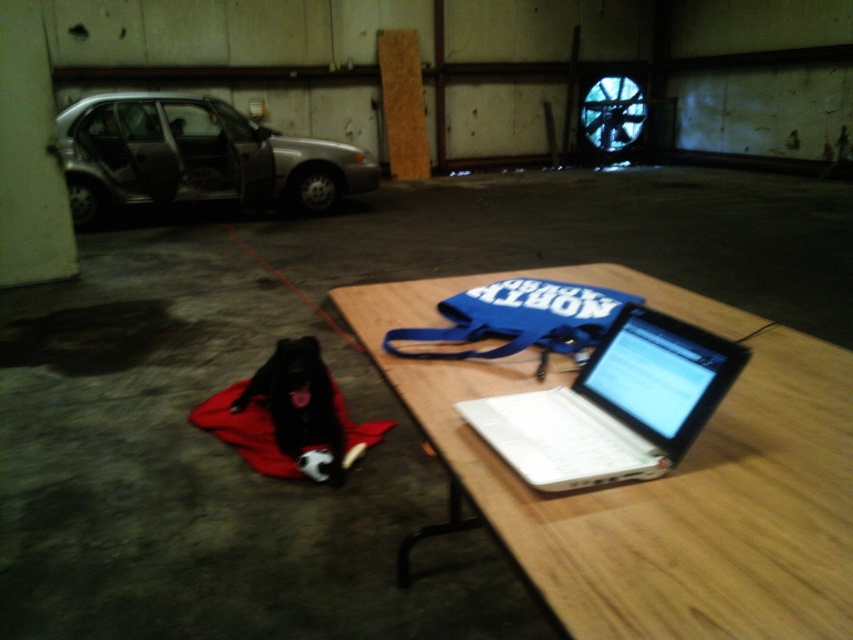
Question: Is silver metallic car at left bigger than black fur dog at lower left?

Choices:
 (A) no
 (B) yes

Answer: (B)

Question: Which point is closer to the camera?

Choices:
 (A) (331, 444)
 (B) (662, 371)

Answer: (B)

Question: Observing the image, what is the correct spatial positioning of wooden table at center in reference to black fur dog at lower left?

Choices:
 (A) left
 (B) right

Answer: (B)

Question: Can you confirm if wooden table at center is bigger than silver metallic car at left?

Choices:
 (A) yes
 (B) no

Answer: (B)

Question: Which of the following is the farthest from the observer?

Choices:
 (A) wooden table at center
 (B) silver metallic car at left
 (C) white plastic laptop at center
 (D) black fur dog at lower left

Answer: (B)

Question: Which object appears farthest from the camera in this image?

Choices:
 (A) black fur dog at lower left
 (B) wooden table at center
 (C) white plastic laptop at center

Answer: (A)